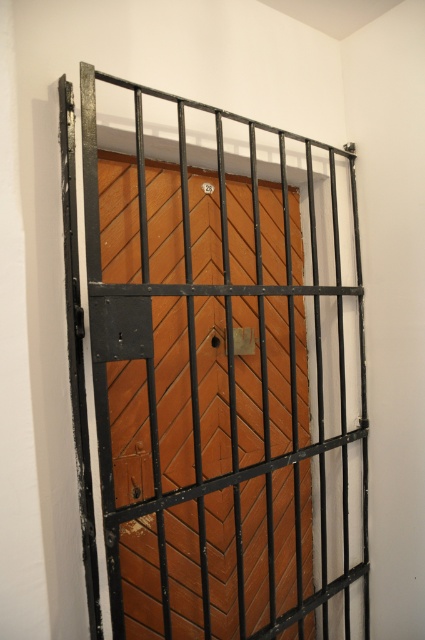
Does brown wooden door at center appear under metallic gold lock at center?

Yes, brown wooden door at center is below metallic gold lock at center.

In the scene shown: Which is below, brown wooden door at center or metallic gold lock at center?

brown wooden door at center is below.

Between point (169, 637) and point (204, 188), which one is positioned behind?

Point (204, 188)

Identify the location of brown wooden door at center. This screenshot has height=640, width=425. (204, 461).